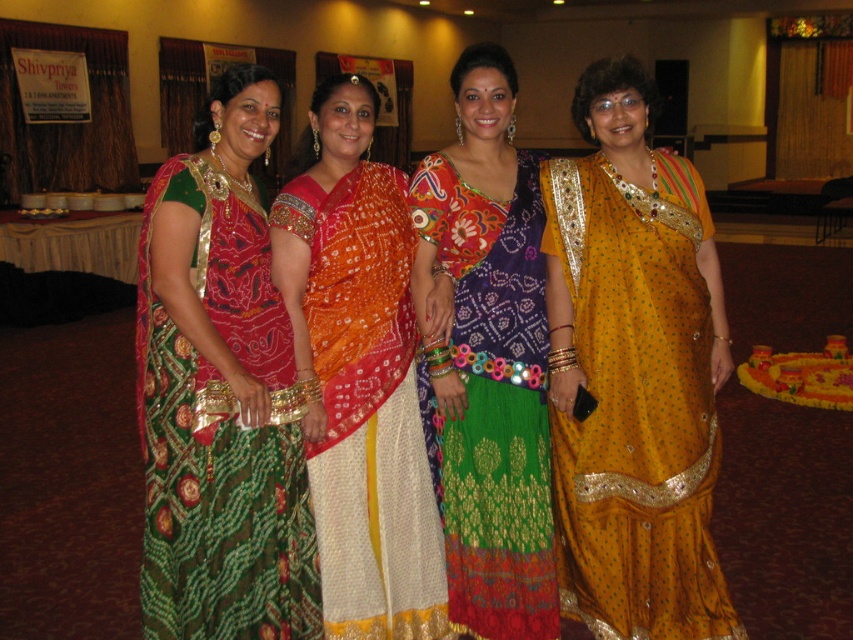
Can you confirm if golden silk saree at center is shorter than multicolored embroidered sari at center?

Correct, golden silk saree at center is not as tall as multicolored embroidered sari at center.

Between golden silk saree at center and multicolored embroidered sari at center, which one is positioned lower?

golden silk saree at center is below.

Between point (573, 100) and point (457, 419), which one is positioned behind?

Point (573, 100)

At what (x,y) coordinates should I click in order to perform the action: click on golden silk saree at center. Please return your answer as a coordinate pair (x, y). This screenshot has width=853, height=640. Looking at the image, I should click on (633, 372).

Is golden silk saree at center positioned in front of orange bandhani sari at center?

No, it is behind orange bandhani sari at center.

Between point (635, 72) and point (386, 460), which one is positioned behind?

Positioned behind is point (386, 460).

Locate an element on the screen. This screenshot has height=640, width=853. golden silk saree at center is located at coordinates (633, 372).

Between green brocade saree at center and orange bandhani sari at center, which one has more height?

orange bandhani sari at center is taller.

Is point (154, 252) positioned in front of point (361, 538)?

Yes, it is.

This screenshot has height=640, width=853. I want to click on green brocade saree at center, so click(219, 394).